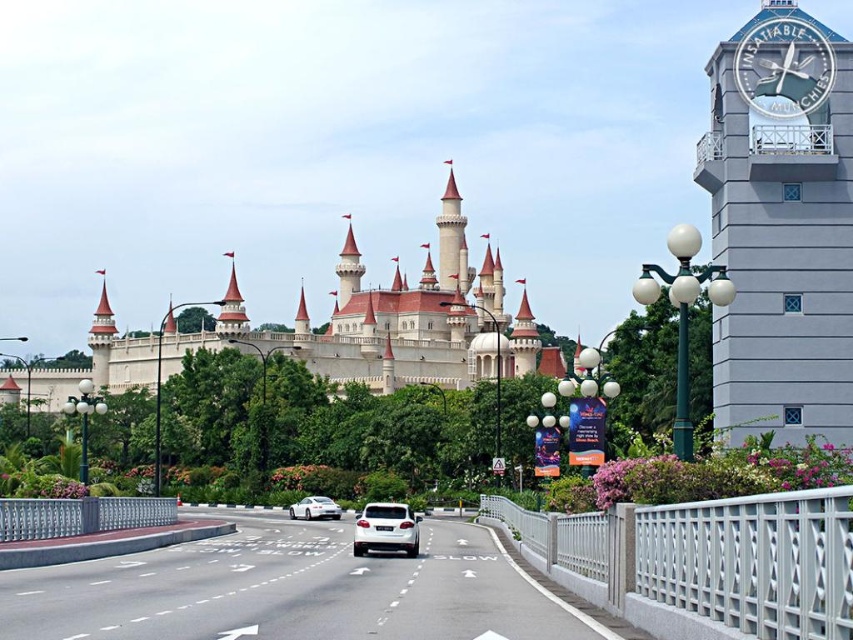
Question: From the image, what is the correct spatial relationship of gray concrete clock tower at upper right in relation to white metallic clock at upper right?

Choices:
 (A) below
 (B) above

Answer: (A)

Question: Does gray concrete clock tower at upper right appear under white matte car at center?

Choices:
 (A) no
 (B) yes

Answer: (A)

Question: Does white asphalt highway at center appear under white matte car at center?

Choices:
 (A) yes
 (B) no

Answer: (B)

Question: Estimate the real-world distances between objects in this image. Which object is closer to the white stone castle at center?

Choices:
 (A) white asphalt highway at center
 (B) white matte car at center
 (C) gray concrete clock tower at upper right
 (D) white metallic clock at upper right

Answer: (B)

Question: Which of the following is the closest to the observer?

Choices:
 (A) (740, 60)
 (B) (93, 604)
 (C) (415, 538)
 (D) (311, 500)

Answer: (B)

Question: Among these objects, which one is nearest to the camera?

Choices:
 (A) white stone castle at center
 (B) white metallic clock at upper right
 (C) white glossy car at center
 (D) gray concrete clock tower at upper right

Answer: (D)